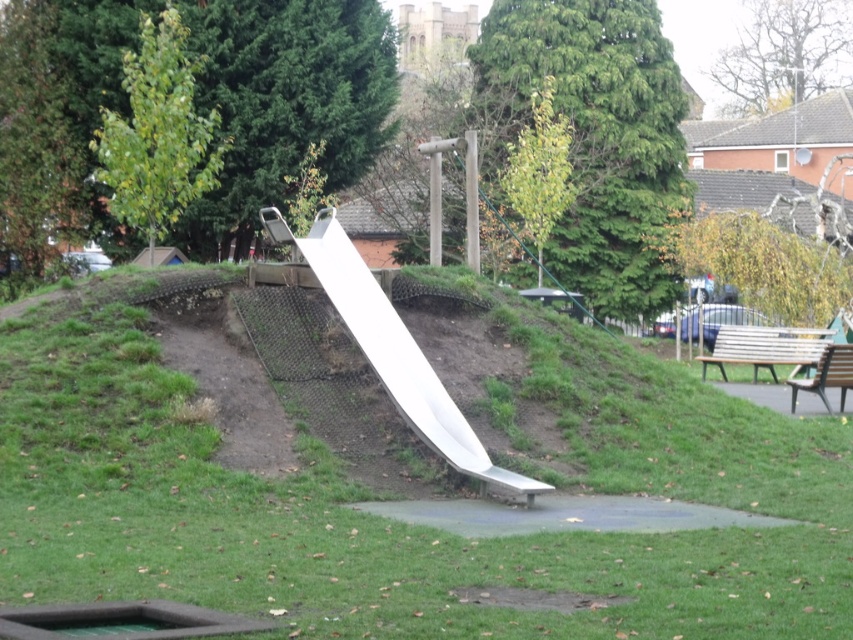
Question: Is green grassy hill at center thinner than white metallic slide at center?

Choices:
 (A) no
 (B) yes

Answer: (A)

Question: Does green grassy hill at center appear on the right side of wooden bench at right?

Choices:
 (A) yes
 (B) no

Answer: (B)

Question: Estimate the real-world distances between objects in this image. Which object is closer to the white metallic slide at center?

Choices:
 (A) wooden bench at right
 (B) green grassy hill at center

Answer: (B)

Question: Which is nearer to the white metallic slide at center?

Choices:
 (A) green grassy hill at center
 (B) brown wooden bench at right
 (C) wooden bench at right

Answer: (A)

Question: Does green grassy hill at center appear under white metallic slide at center?

Choices:
 (A) yes
 (B) no

Answer: (A)

Question: Which of the following is the closest to the observer?

Choices:
 (A) green grassy hill at center
 (B) white metallic slide at center
 (C) brown wooden bench at right

Answer: (A)